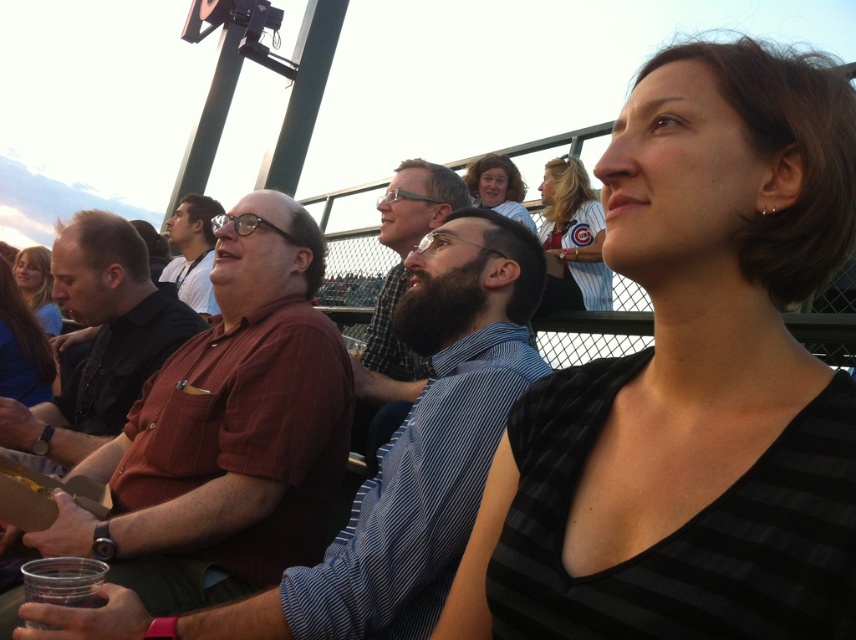
Which is more to the left, black striped shirt at upper right or brown shirt at center?

brown shirt at center

Is black striped shirt at upper right further to camera compared to brown shirt at center?

No, black striped shirt at upper right is closer to the viewer.

Which is in front, point (782, 524) or point (185, 269)?

Point (782, 524)

Identify the location of black striped shirt at upper right. (691, 384).

Between black striped shirt at upper right and blue fabric shirt at lower left, which one has less height?

blue fabric shirt at lower left

Is point (827, 160) behind point (19, 298)?

No.

The width and height of the screenshot is (856, 640). I want to click on black striped shirt at upper right, so click(x=691, y=384).

Can you confirm if black shirt at left is taller than blue fabric shirt at lower left?

Correct, black shirt at left is much taller as blue fabric shirt at lower left.

Which is behind, point (0, 401) or point (19, 365)?

Point (19, 365)

What are the coordinates of `black shirt at left` in the screenshot? It's located at (98, 342).